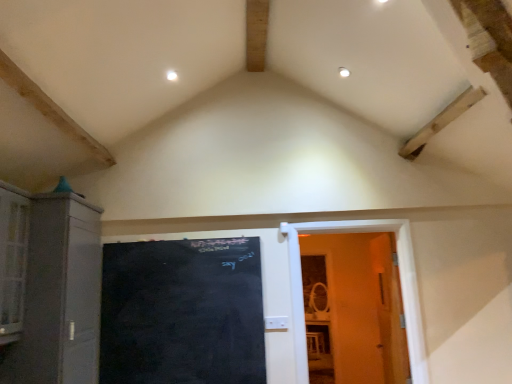
Question: From the image's perspective, is matte gray cabinet at left above or below wooden door at right?

Choices:
 (A) below
 (B) above

Answer: (B)

Question: Would you say matte gray cabinet at left is inside or outside wooden door at right?

Choices:
 (A) inside
 (B) outside

Answer: (B)

Question: Which of these objects is positioned farthest from the wooden door at right?

Choices:
 (A) matte gray cabinet at left
 (B) black chalkboard at center

Answer: (A)

Question: Which object is positioned farthest from the matte gray cabinet at left?

Choices:
 (A) wooden door at right
 (B) black chalkboard at center

Answer: (A)